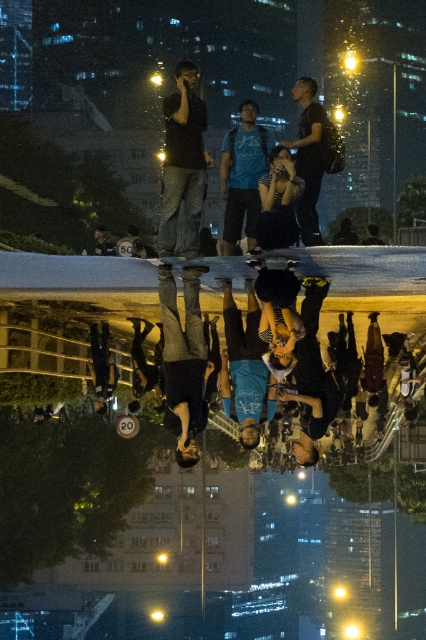
You are a photographer trying to capture a reflection of the dark brown leather skateboard at center and the matte black phone at center in the puddle. Which object will appear closer to the left side of the reflection?

The matte black phone at center will appear closer to the left side of the reflection because the dark brown leather skateboard at center is positioned to the right of it in the actual scene, so their reflections would mirror this arrangement with the phone on the left.

You are standing on the reflective surface in the nighttime urban scene. There is a dark brown leather skateboard at center. Can you see its reflection in the puddle below you?

Yes, since the dark brown leather skateboard at center is on the reflective surface, its reflection would be visible in the puddle below.